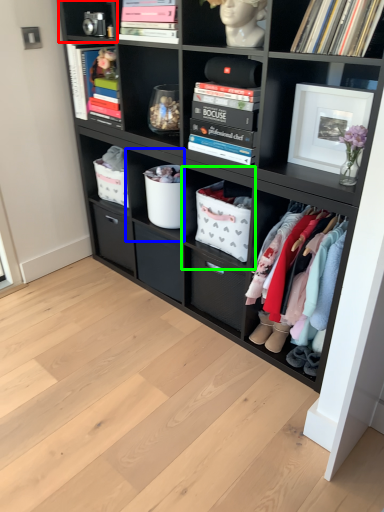
Question: Which object is positioned farthest from cabinet (highlighted by a red box)? Select from shelf (highlighted by a blue box) and shelf (highlighted by a green box).

Choices:
 (A) shelf
 (B) shelf

Answer: (B)